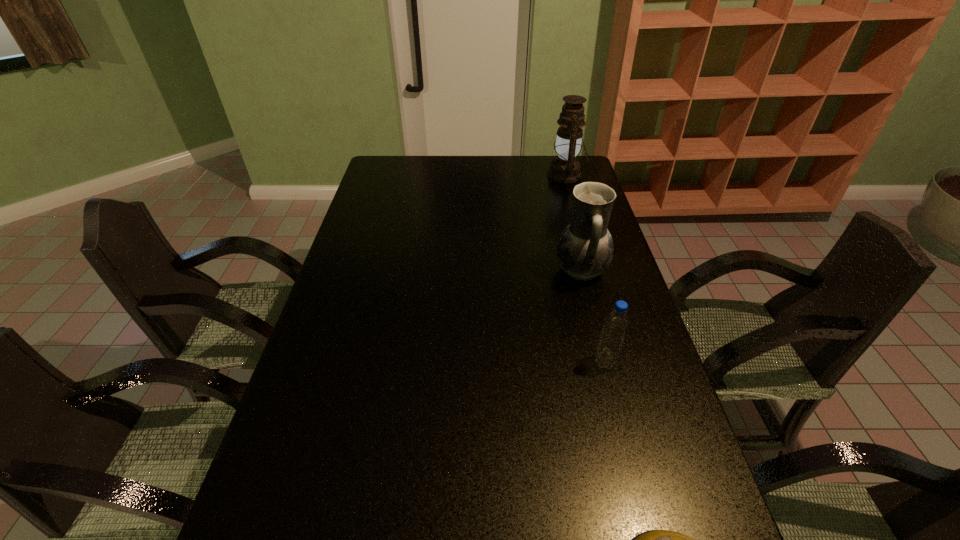
Select which object appears as the closest to the volleyball. Please provide its 2D coordinates. Your answer should be formatted as a tuple, i.e. [(x, y)], where the tuple contains the x and y coordinates of a point satisfying the conditions above.

[(615, 326)]

The image size is (960, 540). I want to click on vacant region that satisfies the following two spatial constraints: 1. on the front-facing side of the second farthest object; 2. on the left side of the third farthest object, so 605,362.

The image size is (960, 540). Find the location of `free space that satisfies the following two spatial constraints: 1. on the front-facing side of the second nearest object; 2. on the left side of the pitcher`. free space that satisfies the following two spatial constraints: 1. on the front-facing side of the second nearest object; 2. on the left side of the pitcher is located at coordinates (x=605, y=362).